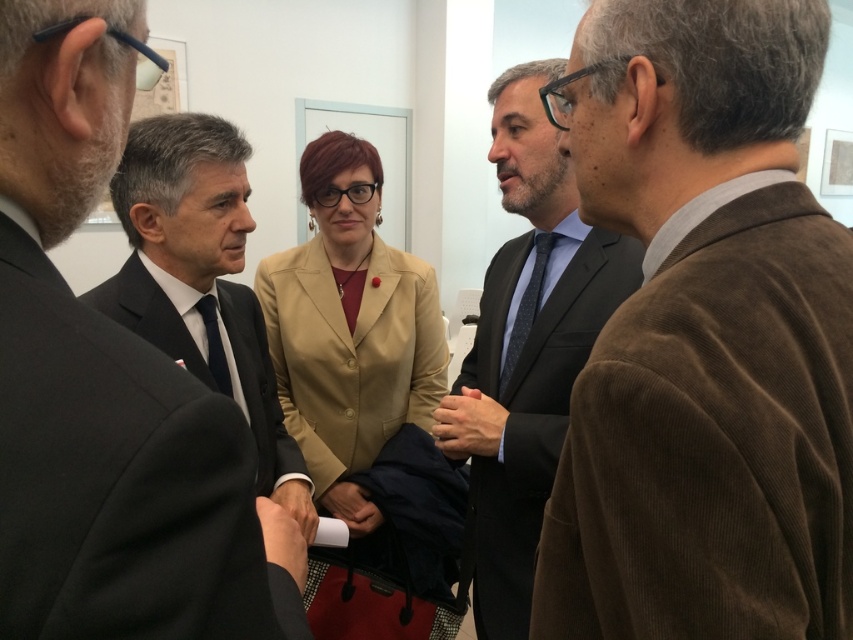
Question: Considering the real-world distances, which object is closest to the matte black handbag at center?

Choices:
 (A) smooth skin hand at center
 (B) matte black tie at left

Answer: (B)

Question: Observing the image, what is the correct spatial positioning of dark blue textured tie at center in reference to matte black handbag at center?

Choices:
 (A) left
 (B) right

Answer: (B)

Question: Can you confirm if matte black suit at center is positioned to the left of smooth leather hand at center?

Choices:
 (A) yes
 (B) no

Answer: (B)

Question: Which point appears closest to the camera in this image?

Choices:
 (A) (343, 492)
 (B) (297, 561)

Answer: (B)

Question: Is matte black suit at center behind smooth brown hand at center?

Choices:
 (A) yes
 (B) no

Answer: (B)

Question: Among these objects, which one is nearest to the camera?

Choices:
 (A) matte black tie at left
 (B) matte black handbag at center
 (C) dark blue textured tie at center

Answer: (A)